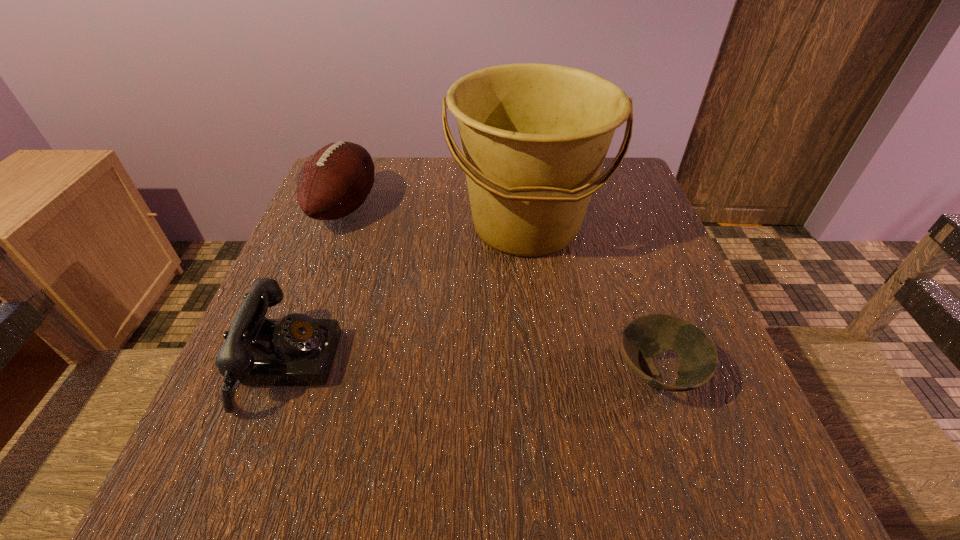
This screenshot has height=540, width=960. In the image, there is a desktop. Identify the location of vacant space at the far right corner. (625, 207).

Where is `vacant area that lies between the shortest object and the second tallest object`? vacant area that lies between the shortest object and the second tallest object is located at coordinates (500, 291).

This screenshot has width=960, height=540. What are the coordinates of `free spot between the shortest object and the telephone` in the screenshot? It's located at (471, 369).

The image size is (960, 540). I want to click on empty space between the second tallest object and the telephone, so click(x=315, y=286).

You are a GUI agent. You are given a task and a screenshot of the screen. Output one action in this format:
    pyautogui.click(x=<x>, y=<y>)
    Task: Click on the free space between the football (American) and the tallest object
    Image resolution: width=960 pixels, height=540 pixels.
    Given the screenshot: What is the action you would take?
    pyautogui.click(x=435, y=217)

The image size is (960, 540). What are the coordinates of `blank region between the football (American) and the tallest object` in the screenshot? It's located at (435, 217).

Identify the location of empty space that is in between the telephone and the football (American). (315, 286).

This screenshot has width=960, height=540. I want to click on vacant area that lies between the bucket and the third tallest object, so coord(406,295).

Find the location of `free space between the bowl and the telephone`. free space between the bowl and the telephone is located at coordinates [471, 369].

Find the location of a particular element. The height and width of the screenshot is (540, 960). free area in between the telephone and the bowl is located at coordinates point(471,369).